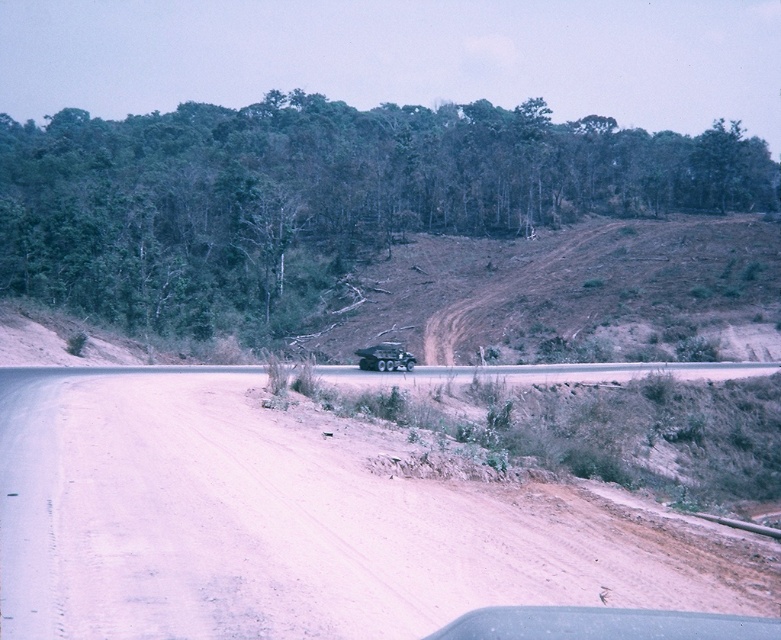
Is dusty sand road at center below green leafy tree at center?

Correct, dusty sand road at center is located below green leafy tree at center.

Is dusty sand road at center positioned behind green leafy tree at center?

That is False.

In the scene shown: Who is more forward, (87, 529) or (155, 157)?

Point (87, 529)

Locate an element on the screen. The image size is (781, 640). dusty sand road at center is located at coordinates point(269,524).

Is dusty sand road at center in front of metallic green jeep at center?

Yes, it is.

Based on the photo, between dusty sand road at center and metallic green jeep at center, which one is positioned higher?

Positioned higher is metallic green jeep at center.

I want to click on dusty sand road at center, so (x=269, y=524).

Image resolution: width=781 pixels, height=640 pixels. Identify the location of dusty sand road at center. (269, 524).

Looking at this image, is green leafy tree at center bigger than metallic green jeep at center?

Yes.

Which of these two, green leafy tree at center or metallic green jeep at center, stands shorter?

metallic green jeep at center

Is point (539, 116) closer to camera compared to point (401, 364)?

No, it is not.

The image size is (781, 640). Find the location of `green leafy tree at center`. green leafy tree at center is located at coordinates coord(316,196).